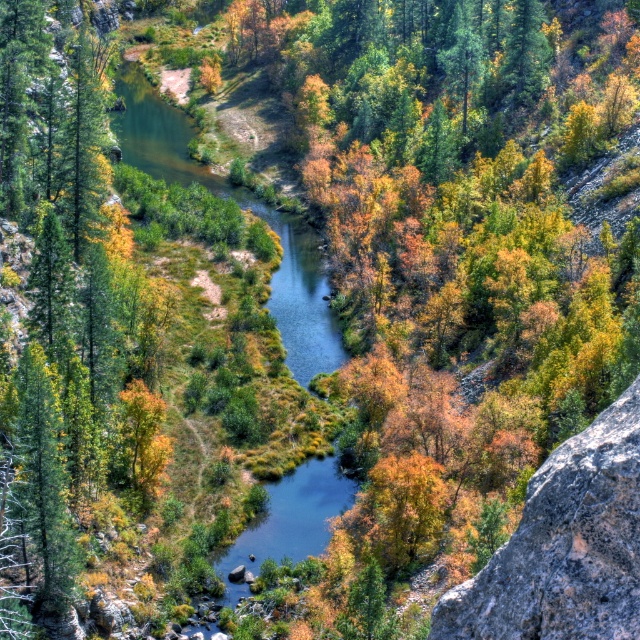
Looking at this image, you are a hiker who wants to cross the river but needs to avoid the gray rough rock at right. Which direction should you head relative to the green matte tree at left to stay safe?

The green matte tree at left is above the gray rough rock at right. To avoid the rock, you should head below the green matte tree at left towards the lower part of the river.